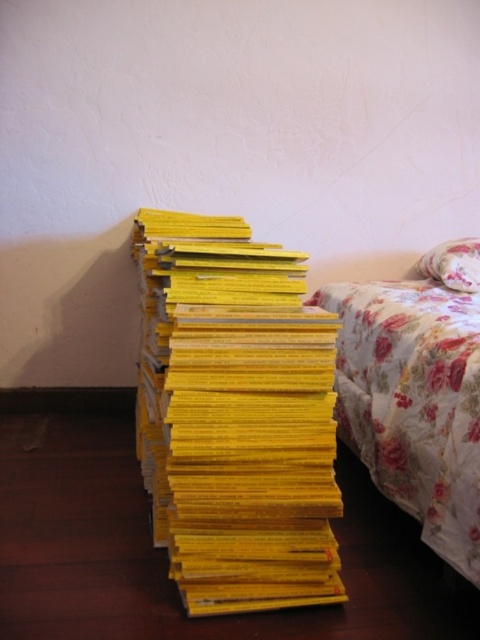
Question: Among these objects, which one is farthest from the camera?

Choices:
 (A) floral fabric pillow at upper right
 (B) floral fabric bed at right
 (C) yellow matte book at center

Answer: (A)

Question: Is yellow matte book at center bigger than floral fabric pillow at upper right?

Choices:
 (A) yes
 (B) no

Answer: (A)

Question: Can you confirm if yellow matte book at center is wider than floral fabric pillow at upper right?

Choices:
 (A) no
 (B) yes

Answer: (B)

Question: Based on their relative distances, which object is farther from the floral fabric bed at right?

Choices:
 (A) floral fabric pillow at upper right
 (B) yellow matte book at center

Answer: (B)

Question: Which point is closer to the camera?

Choices:
 (A) (444, 257)
 (B) (433, 272)
 (C) (193, 348)

Answer: (C)

Question: Does yellow matte book at center appear over floral fabric bed at right?

Choices:
 (A) no
 (B) yes

Answer: (B)